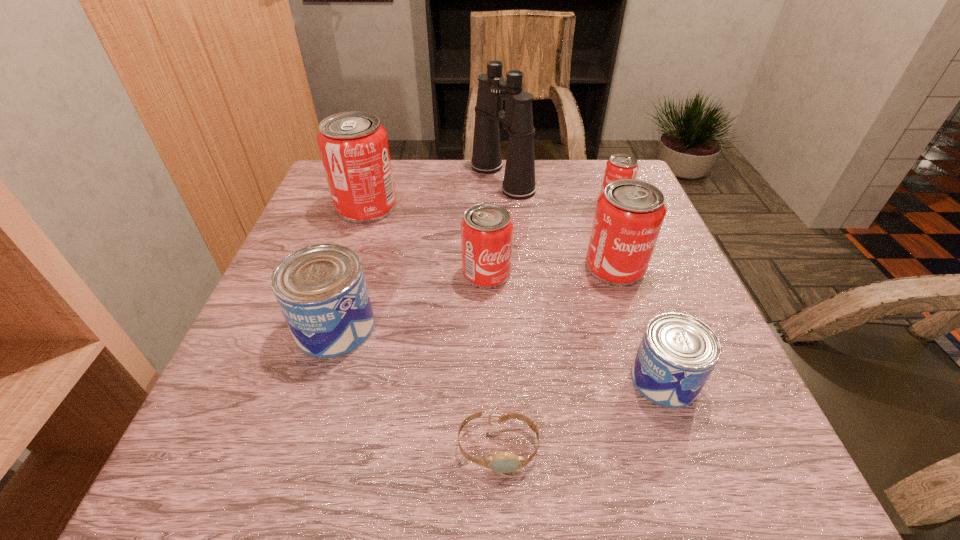
You are a GUI agent. You are given a task and a screenshot of the screen. Output one action in this format:
    pyautogui.click(x=<x>, y=<y>)
    Task: Click on the vacant area that lies between the tallest can and the third biggest red can
    This screenshot has height=540, width=960.
    Given the screenshot: What is the action you would take?
    pyautogui.click(x=426, y=240)

Identify the location of free spot between the sixth shortest object and the third can from left to right. (551, 270).

At what (x,y) coordinates should I click in order to perform the action: click on free spot between the watch and the leftmost red can. Please return your answer as a coordinate pair (x, y). The height and width of the screenshot is (540, 960). Looking at the image, I should click on (432, 327).

Find the location of a particular element. The width and height of the screenshot is (960, 540). free point between the fifth shortest can and the bigger blue can is located at coordinates (475, 297).

Identify the location of vacant area that lies between the nearest object and the smallest red can. (557, 322).

In order to click on free spot between the bigger blue can and the smaller blue can in this screenshot , I will do `click(499, 354)`.

Locate an element on the screen. This screenshot has height=540, width=960. vacant space that is in between the smaller blue can and the second smallest red can is located at coordinates (575, 326).

The width and height of the screenshot is (960, 540). I want to click on vacant area that lies between the sixth shortest object and the bigger blue can, so click(475, 297).

Find the location of a particular element. This screenshot has height=540, width=960. free spot between the smallest red can and the seventh shortest object is located at coordinates (491, 202).

Locate an element on the screen. The width and height of the screenshot is (960, 540). object that is the closest to the right blue can is located at coordinates (629, 214).